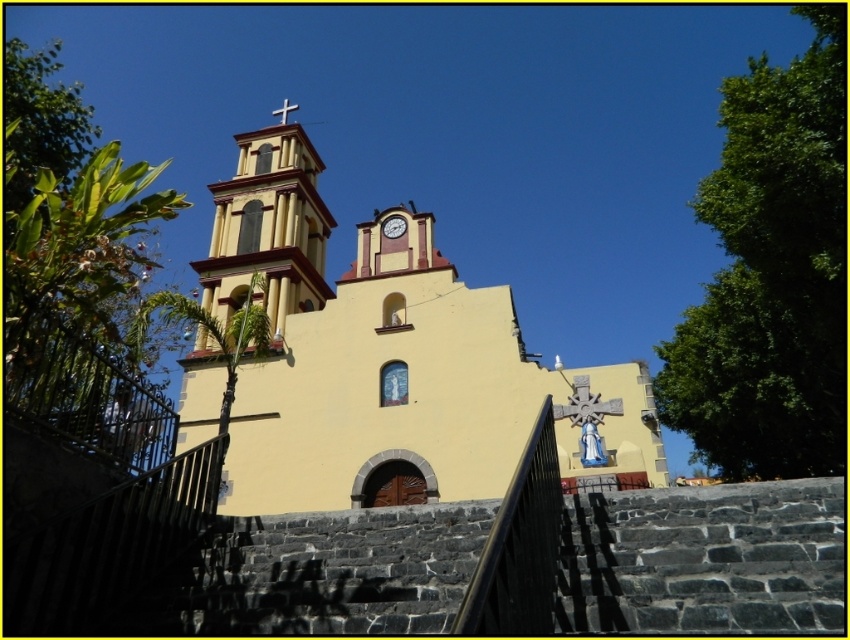
Question: Is green leafy palm at left further to the viewer compared to metallic cross at upper center?

Choices:
 (A) no
 (B) yes

Answer: (A)

Question: Does yellow stucco bell tower at upper left have a smaller size compared to green leafy palm at left?

Choices:
 (A) yes
 (B) no

Answer: (A)

Question: Which point appears closest to the camera in this image?

Choices:
 (A) (282, 113)
 (B) (8, 196)
 (C) (287, 236)
 (D) (306, 467)

Answer: (B)

Question: Which point is farther to the camera?

Choices:
 (A) (830, 218)
 (B) (299, 150)
 (C) (295, 108)
 (D) (251, 132)

Answer: (C)

Question: Does yellow stucco bell tower at upper left have a smaller size compared to green leafy palm at left?

Choices:
 (A) yes
 (B) no

Answer: (A)

Question: Which of the following is the farthest from the observer?

Choices:
 (A) [x=392, y=323]
 (B) [x=718, y=108]
 (C) [x=256, y=173]
 (D) [x=391, y=225]

Answer: (B)